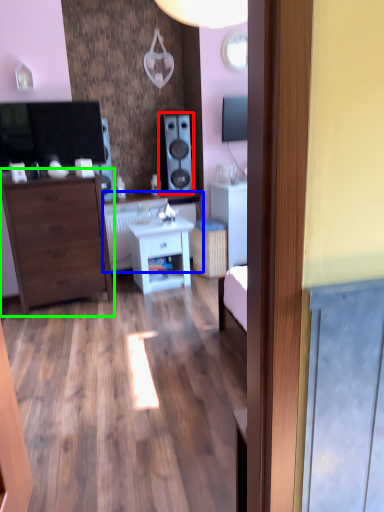
Question: Estimate the real-world distances between objects in this image. Which object is closer to speaker (highlighted by a red box), counter top (highlighted by a blue box) or chest of drawers (highlighted by a green box)?

Choices:
 (A) counter top
 (B) chest of drawers

Answer: (A)